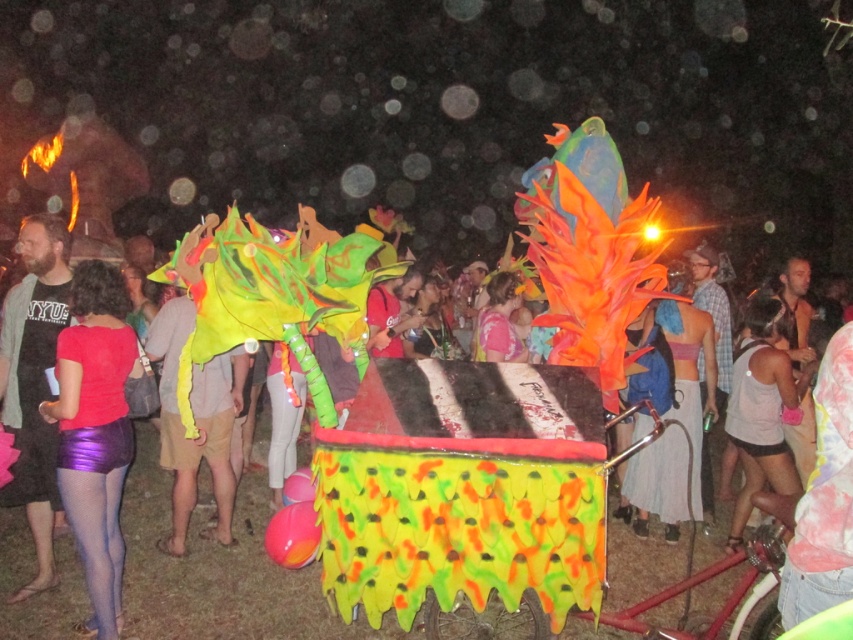
Does purple shiny shorts at lower left have a lesser height compared to matte black shirt at left?

Yes.

Between purple shiny shorts at lower left and matte black shirt at left, which one appears on the right side from the viewer's perspective?

purple shiny shorts at lower left is more to the right.

Which is behind, point (82, 298) or point (59, 237)?

The point (59, 237) is behind.

You are a GUI agent. You are given a task and a screenshot of the screen. Output one action in this format:
    pyautogui.click(x=<x>, y=<y>)
    Task: Click on the purple shiny shorts at lower left
    The height and width of the screenshot is (640, 853).
    Given the screenshot: What is the action you would take?
    pyautogui.click(x=96, y=429)

Who is taller, matte black shirt at left or neon yellow fabric at center?

With more height is matte black shirt at left.

Consider the image. Can you confirm if matte black shirt at left is thinner than neon yellow fabric at center?

Yes, matte black shirt at left is thinner than neon yellow fabric at center.

Does point (12, 394) come closer to viewer compared to point (229, 401)?

Yes, point (12, 394) is in front of point (229, 401).

Find the location of `matte black shirt at left`. matte black shirt at left is located at coordinates (33, 381).

Consider the image. Is purple shiny shorts at lower left further to camera compared to neon yellow fabric at center?

No, purple shiny shorts at lower left is in front of neon yellow fabric at center.

Between point (97, 561) and point (171, 532), which one is positioned in front?

Positioned in front is point (97, 561).

The width and height of the screenshot is (853, 640). Identify the location of purple shiny shorts at lower left. (96, 429).